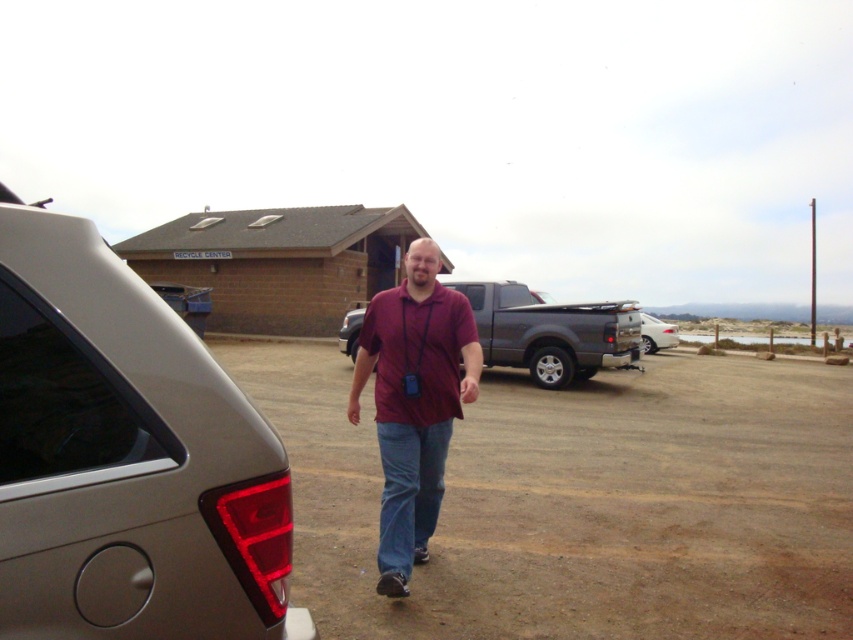
You are a photographer trying to capture both the maroon fabric shirt at center and the white glossy car at center in a single frame. Which object should you focus on first to ensure both are in the frame without moving the camera?

The maroon fabric shirt at center is smaller than the white glossy car at center, so you should focus on the maroon fabric shirt at center first to ensure both are in the frame without moving the camera.

You are standing at the point labeled point (282, 609) and want to walk to the recycle center building. Is the recycle center building closer to you than 2 meters?

The distance between you and the recycle center building is 1.82 meters, which is less than 2 meters. Therefore, the recycle center building is closer than 2 meters.

You are standing in the parking lot of the RECYCLE CENTER and see two points marked in the scene. The first point is at coordinates point (x=54, y=280), and the second is at point (x=444, y=432). Which point is closer to you?

Point (x=54, y=280) is closer to the viewer than point (x=444, y=432).